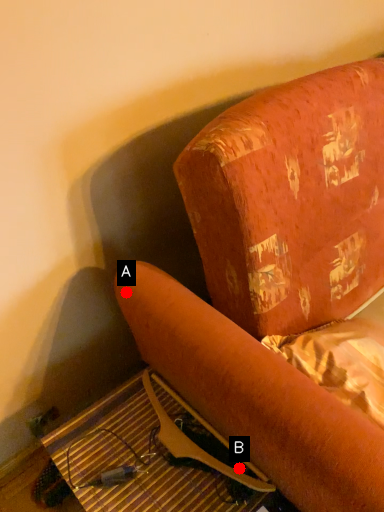
Question: Two points are circled on the image, labeled by A and B beside each circle. Which point is closer to the camera?

Choices:
 (A) A is closer
 (B) B is closer

Answer: (B)